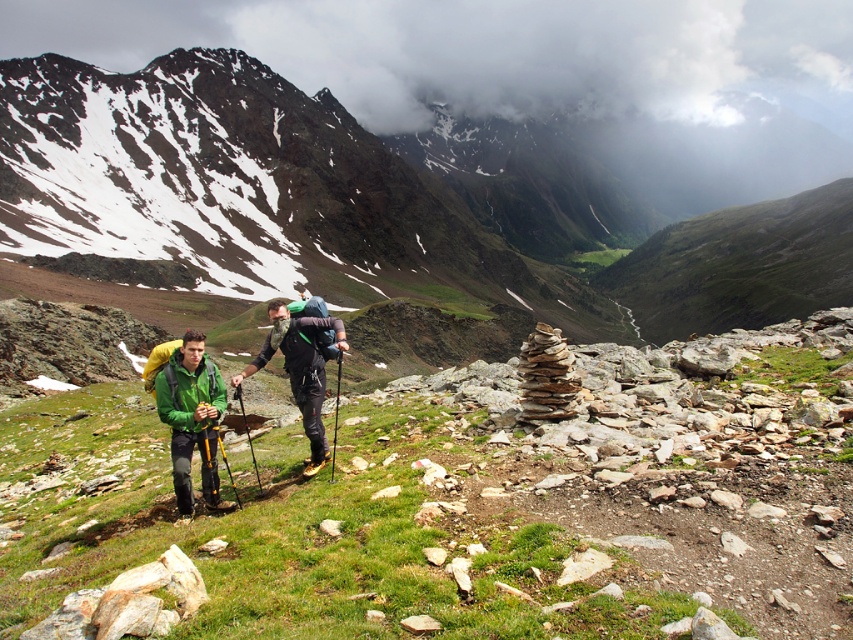
You are a hiker planning to take a photo of the green grassy mountain at center and the green matte jacket at lower left. Which object should you focus on first to ensure both are in the frame?

You should focus on the green grassy mountain at center first because the green matte jacket at lower left is behind it, ensuring both are in the frame by starting with the foreground object.